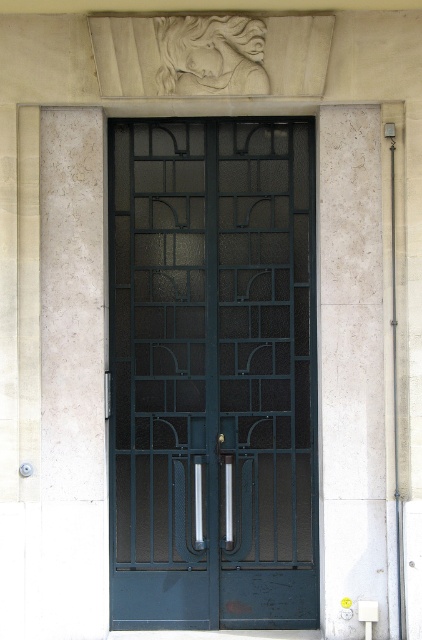
Question: Does dark blue glass door at center have a greater width compared to white marble pillar at left?

Choices:
 (A) no
 (B) yes

Answer: (B)

Question: Which point is closer to the camera?

Choices:
 (A) white marble pillar at right
 (B) dark blue glass door at center

Answer: (A)

Question: Does dark blue glass door at center lie in front of white marble pillar at left?

Choices:
 (A) yes
 (B) no

Answer: (B)

Question: Does white marble pillar at left have a lesser width compared to white marble pillar at right?

Choices:
 (A) no
 (B) yes

Answer: (A)

Question: Which object appears farthest from the camera in this image?

Choices:
 (A) white marble pillar at left
 (B) dark blue glass door at center
 (C) white marble pillar at right

Answer: (B)

Question: Which of the following is the farthest from the observer?

Choices:
 (A) (357, 317)
 (B) (135, 228)
 (C) (75, 412)

Answer: (B)